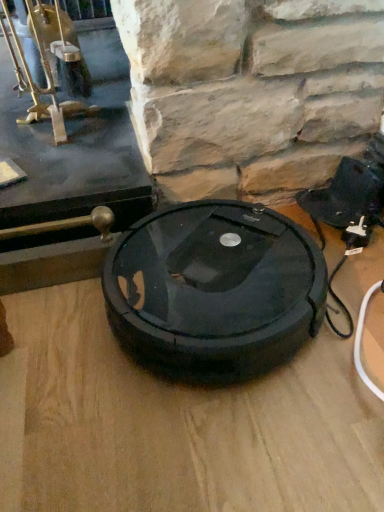
Question: Considering the relative positions of black rubber robot vacuum cleaner at center and black plastic table top at center in the image provided, is black rubber robot vacuum cleaner at center in front of black plastic table top at center?

Choices:
 (A) yes
 (B) no

Answer: (B)

Question: Is black rubber robot vacuum cleaner at center thinner than black plastic table top at center?

Choices:
 (A) no
 (B) yes

Answer: (B)

Question: From the image's perspective, is black rubber robot vacuum cleaner at center located beneath black plastic table top at center?

Choices:
 (A) yes
 (B) no

Answer: (A)

Question: Is black rubber robot vacuum cleaner at center turned away from black plastic table top at center?

Choices:
 (A) yes
 (B) no

Answer: (B)

Question: Does black rubber robot vacuum cleaner at center have a lesser height compared to black plastic table top at center?

Choices:
 (A) no
 (B) yes

Answer: (A)

Question: Considering the relative positions of black rubber robot vacuum cleaner at center and black plastic table top at center in the image provided, is black rubber robot vacuum cleaner at center to the left of black plastic table top at center from the viewer's perspective?

Choices:
 (A) yes
 (B) no

Answer: (B)

Question: Is black rubber robot vacuum cleaner at center a part of black plastic table top at center?

Choices:
 (A) yes
 (B) no

Answer: (B)

Question: Considering the relative positions of black plastic table top at center and black rubber robot vacuum cleaner at center in the image provided, is black plastic table top at center to the left of black rubber robot vacuum cleaner at center from the viewer's perspective?

Choices:
 (A) yes
 (B) no

Answer: (A)

Question: Does black plastic table top at center touch black rubber robot vacuum cleaner at center?

Choices:
 (A) no
 (B) yes

Answer: (A)

Question: Can you confirm if black plastic table top at center is bigger than black rubber robot vacuum cleaner at center?

Choices:
 (A) no
 (B) yes

Answer: (B)

Question: Does black plastic table top at center come behind black rubber robot vacuum cleaner at center?

Choices:
 (A) no
 (B) yes

Answer: (A)

Question: Is black plastic table top at center not within black rubber robot vacuum cleaner at center?

Choices:
 (A) no
 (B) yes

Answer: (B)

Question: Which is correct: black plastic table top at center is inside black rubber robot vacuum cleaner at center, or outside of it?

Choices:
 (A) outside
 (B) inside

Answer: (A)